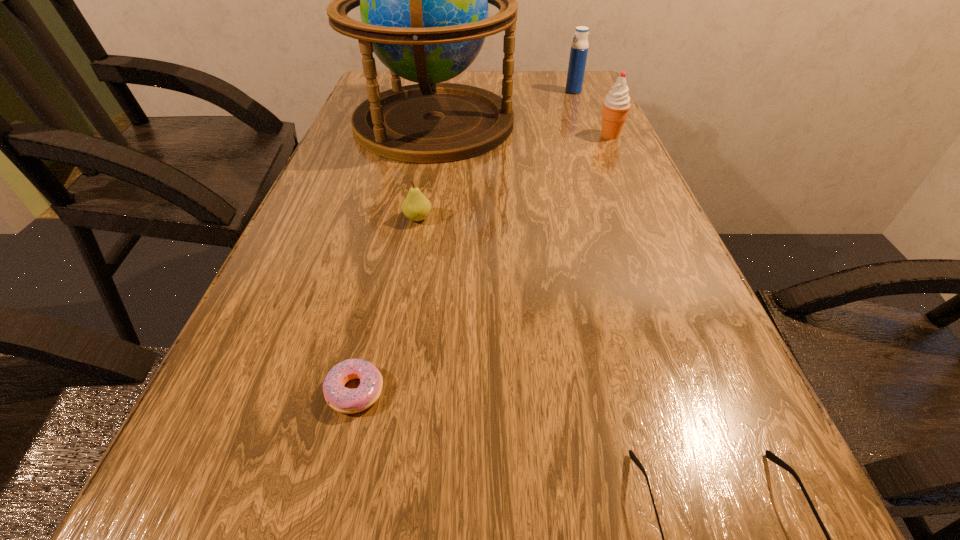
Identify the location of the tallest object. (423, 0).

The height and width of the screenshot is (540, 960). Identify the location of water bottle. (579, 48).

Find the location of a particular element. This screenshot has height=540, width=960. icecream is located at coordinates (616, 105).

Locate an element on the screen. This screenshot has height=540, width=960. the fourth farthest object is located at coordinates (416, 207).

Where is `the third shortest object`? This screenshot has width=960, height=540. the third shortest object is located at coordinates (416, 207).

This screenshot has width=960, height=540. Identify the location of the shortest object. (345, 400).

At what (x,y) coordinates should I click in order to perform the action: click on doughnut. Please return your answer as a coordinate pair (x, y). Image resolution: width=960 pixels, height=540 pixels. Looking at the image, I should click on click(x=345, y=400).

You are a GUI agent. You are given a task and a screenshot of the screen. Output one action in this format:
    pyautogui.click(x=<x>, y=<y>)
    Task: Click on the vacant region located 0.210m on the front of the tallest object
    This screenshot has width=960, height=540.
    Given the screenshot: What is the action you would take?
    pyautogui.click(x=418, y=215)

Image resolution: width=960 pixels, height=540 pixels. Find the location of `vacant space located on the front of the water bottle`. vacant space located on the front of the water bottle is located at coordinates (592, 140).

The width and height of the screenshot is (960, 540). Identify the location of vacant area located 0.310m on the left of the icecream. (481, 136).